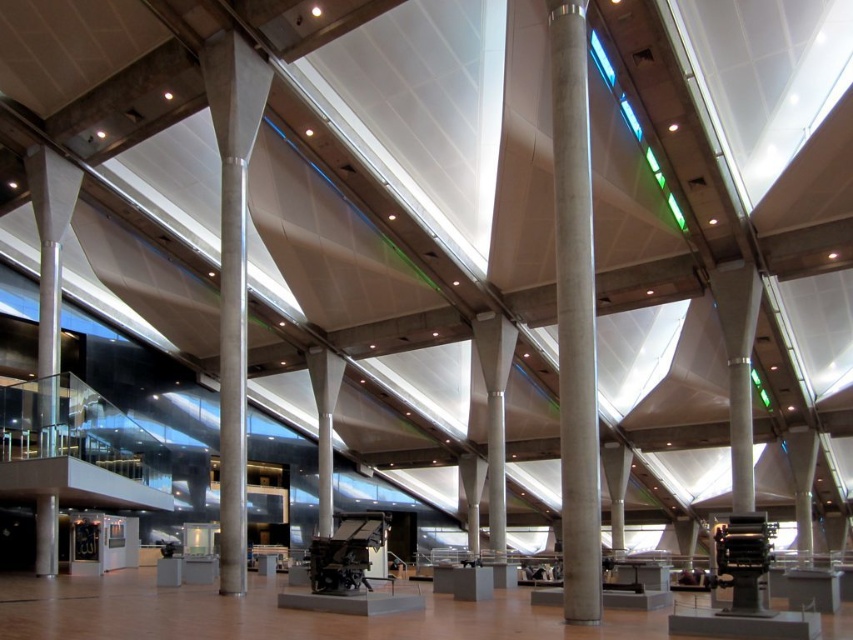
Question: Can you confirm if concrete column at center is smaller than concrete at center?

Choices:
 (A) yes
 (B) no

Answer: (A)

Question: Which point is farther from the camera taking this photo?

Choices:
 (A) (576, 72)
 (B) (265, 64)

Answer: (B)

Question: Is concrete column at center in front of concrete at center?

Choices:
 (A) no
 (B) yes

Answer: (B)

Question: In this image, where is concrete column at center located relative to concrete at center?

Choices:
 (A) left
 (B) right

Answer: (B)